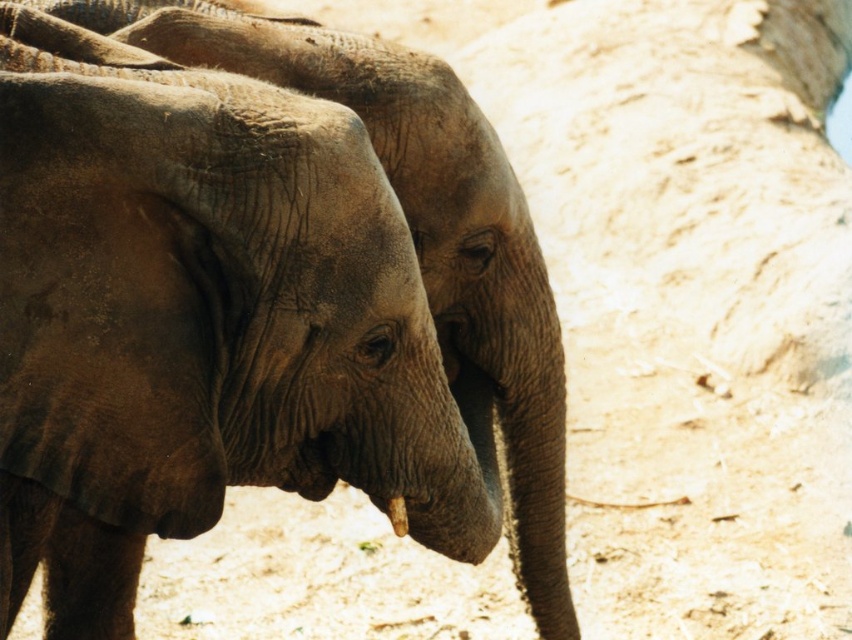
You are a photographer standing in front of the elephants. You want to take a photo of the two points labeled as point (498, 305) and point (401, 529). Which point is closer to your camera?

Point (401, 529) is closer to the camera because it is less further than point (498, 305).

From the picture: You are a wildlife photographer trying to capture a closeup of the white matte tusk at lower center and the gray textured elephant at center. Given that your camera can only focus on objects within a 2 meter width, will both fit in the frame?

The gray textured elephant at center is wider than the white matte tusk at lower center. Since the camera can focus on objects within a 2 meter width, both the gray textured elephant at center and the white matte tusk at lower center can fit in the frame as long as their combined width does not exceed 2 meters. However, the description only states the elephant is wider than the tusk but does not provide exact measurements, so it is uncertain if both will fit without knowing their exact widths.

From the picture: You are an animal researcher observing the gray textured elephant at center and the white matte tusk at lower center. Which object is closer to you?

The gray textured elephant at center is closer to you because it is positioned further to the viewer than the white matte tusk at lower center.